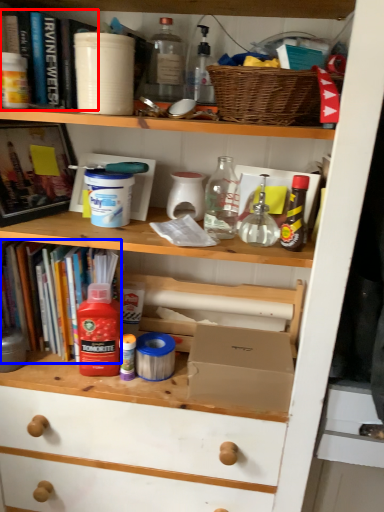
Question: Which object appears closest to the camera in this image, book (highlighted by a red box) or book (highlighted by a blue box)?

Choices:
 (A) book
 (B) book

Answer: (A)